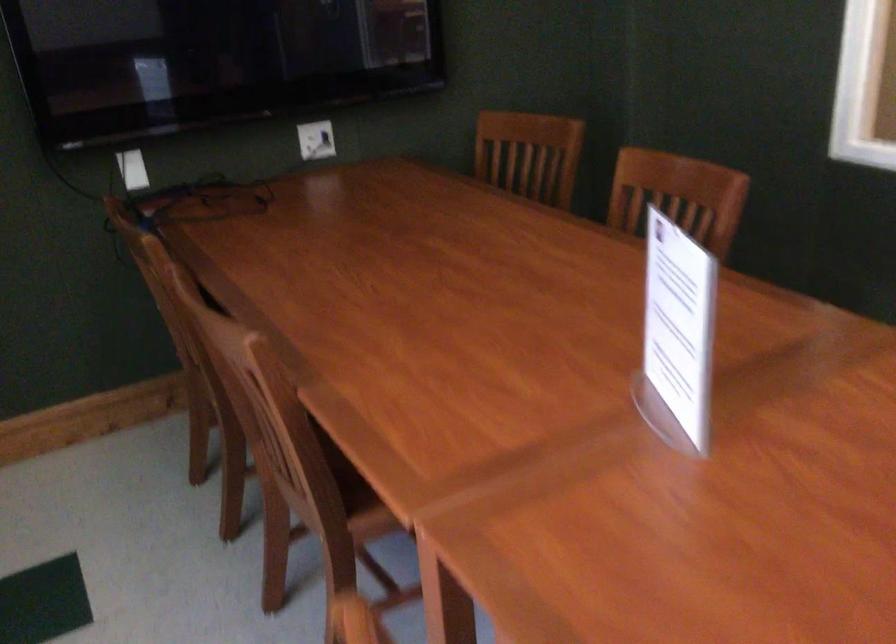
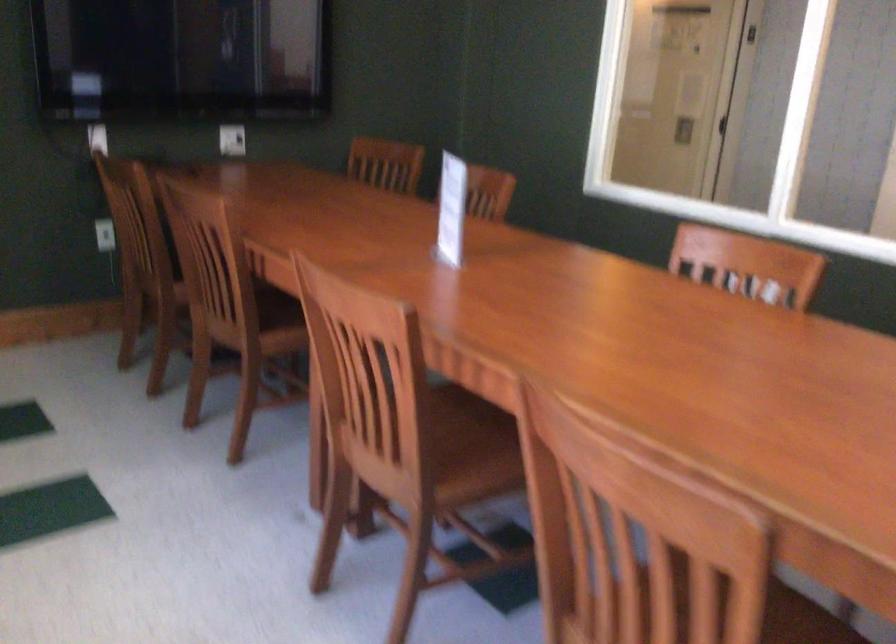
In the second image, find the point that corresponds to (x=304, y=473) in the first image.

(239, 303)